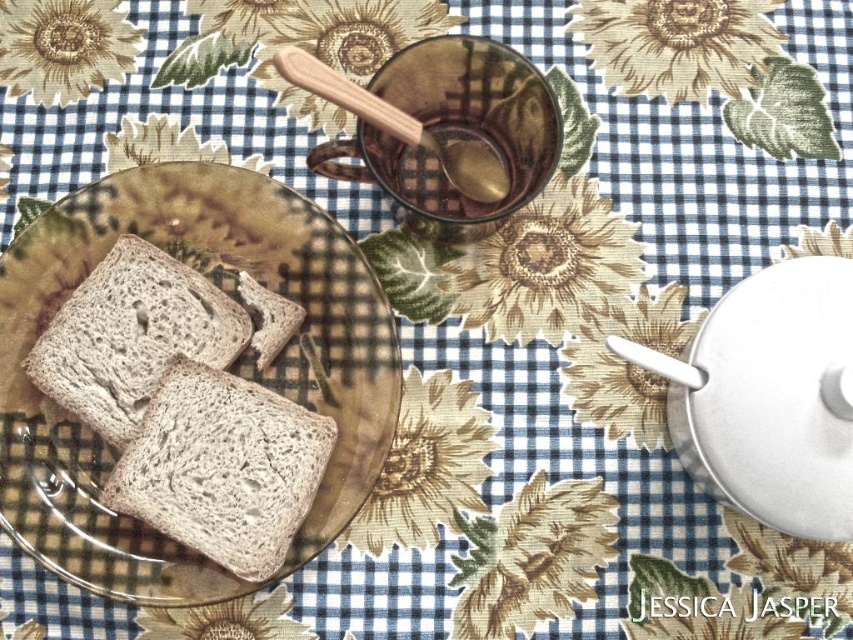
Does point (264, 433) come closer to viewer compared to point (131, 282)?

That is True.

Between brown textured bread at center and brown matte bread at left, which one appears on the left side from the viewer's perspective?

brown matte bread at left is more to the left.

Find the location of a particular element. brown textured bread at center is located at coordinates (222, 467).

Can you confirm if brown matte plate at center-left is taller than wooden spoon at upper center?

Indeed, brown matte plate at center-left has a greater height compared to wooden spoon at upper center.

Between brown matte plate at center-left and wooden spoon at upper center, which one appears on the right side from the viewer's perspective?

wooden spoon at upper center

This screenshot has width=853, height=640. Identify the location of brown matte plate at center-left. (231, 368).

Can you confirm if brown matte plate at center-left is positioned to the right of brown matte bread at left?

Yes, brown matte plate at center-left is to the right of brown matte bread at left.

Does point (228, 218) come behind point (148, 248)?

Yes, it is behind point (148, 248).

The height and width of the screenshot is (640, 853). What are the coordinates of `brown matte plate at center-left` in the screenshot? It's located at (231, 368).